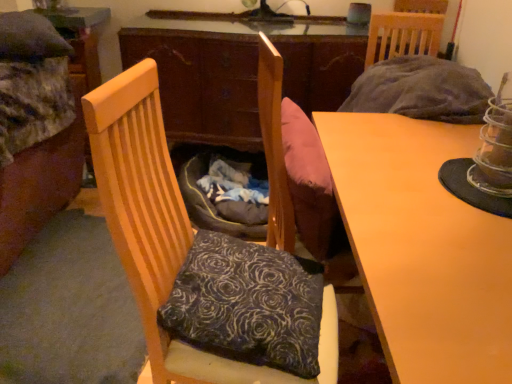
This screenshot has width=512, height=384. Identify the location of velvet fabric bed at left. (38, 126).

Find the location of `wooden chair at left`. wooden chair at left is located at coordinates (164, 230).

Is wooden chair at left next to matte wood desk at center and touching it?

No, wooden chair at left is not beside matte wood desk at center.

From a real-world perspective, does wooden chair at left sit lower than matte wood desk at center?

No, from a real-world perspective, wooden chair at left is not below matte wood desk at center.

Is point (139, 166) farther from viewer compared to point (353, 228)?

No, (139, 166) is in front of (353, 228).

Based on the photo, which of these two, wooden chair at left or matte wood desk at center, stands shorter?

matte wood desk at center.

From the image's perspective, is velvet floral pillow at center under wooden chair at left?

Yes.

Can you confirm if velvet floral pillow at center is wider than wooden chair at left?

In fact, velvet floral pillow at center might be narrower than wooden chair at left.

This screenshot has height=384, width=512. Find the location of `pillow that is behind the wooden chair at left`. pillow that is behind the wooden chair at left is located at coordinates point(247,304).

Between velvet floral pillow at center and wooden chair at left, which one has smaller size?

With smaller size is velvet floral pillow at center.

From a real-world perspective, is velvet floral pillow at center on top of velvet fabric bed at left?

Yes, from a real-world perspective, velvet floral pillow at center is above velvet fabric bed at left.

This screenshot has height=384, width=512. In order to click on pillow on the right of velvet fabric bed at left in this screenshot , I will do `click(247, 304)`.

Which of these two, velvet floral pillow at center or velvet fabric bed at left, stands taller?

velvet fabric bed at left is taller.

How much distance is there between wooden chair at left and velvet floral pillow at center?

wooden chair at left and velvet floral pillow at center are 12.65 centimeters apart from each other.

Considering the relative sizes of wooden chair at left and velvet floral pillow at center in the image provided, is wooden chair at left thinner than velvet floral pillow at center?

No, wooden chair at left is not thinner than velvet floral pillow at center.

From the image's perspective, is wooden chair at left positioned above or below velvet floral pillow at center?

Based on their image positions, wooden chair at left is located above velvet floral pillow at center.

Does wooden chair at left turn towards velvet floral pillow at center?

Yes.

From a real-world perspective, is matte wood desk at center above or below wooden chair at left?

matte wood desk at center is below wooden chair at left.

From the image's perspective, is matte wood desk at center positioned above or below wooden chair at left?

Clearly, from the image's perspective, matte wood desk at center is below wooden chair at left.

Who is bigger, matte wood desk at center or wooden chair at left?

matte wood desk at center is bigger.

Locate an element on the screen. This screenshot has height=384, width=512. chair above the matte wood desk at center (from a real-world perspective) is located at coordinates (164, 230).

From a real-world perspective, which object rests below the other?

In real-world perspective, matte wood desk at center is lower.

Is velvet fabric bed at left not inside matte wood desk at center?

Yes, velvet fabric bed at left is outside of matte wood desk at center.

At what (x,y) coordinates should I click in order to perform the action: click on bed on the left of the matte wood desk at center. Please return your answer as a coordinate pair (x, y). Looking at the image, I should click on (38, 126).

Which is behind, point (134, 187) or point (56, 92)?

The point (56, 92) is farther.

At what (x,y) coordinates should I click in order to perform the action: click on chair above the velvet fabric bed at left (from a real-world perspective). Please return your answer as a coordinate pair (x, y). This screenshot has height=384, width=512. Looking at the image, I should click on (164, 230).

From a real-world perspective, between wooden chair at left and velvet fabric bed at left, who is vertically higher?

In real-world perspective, wooden chair at left is above.

Would you say velvet fabric bed at left is part of wooden chair at left's contents?

That's incorrect, velvet fabric bed at left is not inside wooden chair at left.

Find the location of a particular element. This screenshot has width=512, height=384. chair behind the matte wood desk at center is located at coordinates (164, 230).

I want to click on pillow located on the right of wooden chair at left, so coord(247,304).

Estimate the real-world distances between objects in this image. Which object is further from velvet fabric bed at left, wooden chair at left or velvet floral pillow at center?

Based on the image, velvet floral pillow at center appears to be further to velvet fabric bed at left.

Considering their positions, is velvet floral pillow at center positioned closer to matte wood desk at center than wooden chair at left?

velvet floral pillow at center.

When comparing their distances from matte wood desk at center, does wooden chair at left or velvet floral pillow at center seem further?

wooden chair at left.

Considering their positions, is matte wood desk at center positioned further to wooden chair at left than velvet fabric bed at left?

Among the two, velvet fabric bed at left is located further to wooden chair at left.

Which object lies nearer to the anchor point wooden chair at left, velvet floral pillow at center or matte wood desk at center?

Based on the image, velvet floral pillow at center appears to be nearer to wooden chair at left.

Looking at the image, which one is located closer to velvet fabric bed at left, velvet floral pillow at center or matte wood desk at center?

velvet floral pillow at center.

Looking at the image, which one is located further to velvet fabric bed at left, wooden chair at left or matte wood desk at center?

matte wood desk at center is positioned further to the anchor velvet fabric bed at left.

Considering their positions, is velvet fabric bed at left positioned closer to matte wood desk at center than velvet floral pillow at center?

Based on the image, velvet floral pillow at center appears to be nearer to matte wood desk at center.

You are a GUI agent. You are given a task and a screenshot of the screen. Output one action in this format:
    pyautogui.click(x=<x>, y=<y>)
    Task: Click on the chair between velvet fabric bed at left and velvet floral pillow at center in the horizontal direction
    This screenshot has height=384, width=512.
    Given the screenshot: What is the action you would take?
    pyautogui.click(x=164, y=230)

Where is `pillow located between velvet fabric bed at left and matte wood desk at center in the left-right direction`? The width and height of the screenshot is (512, 384). pillow located between velvet fabric bed at left and matte wood desk at center in the left-right direction is located at coordinates (247, 304).

Locate an element on the screen. The height and width of the screenshot is (384, 512). pillow between wooden chair at left and matte wood desk at center from left to right is located at coordinates (247, 304).

Identify the location of chair between velvet fabric bed at left and matte wood desk at center in the horizontal direction. The width and height of the screenshot is (512, 384). (164, 230).